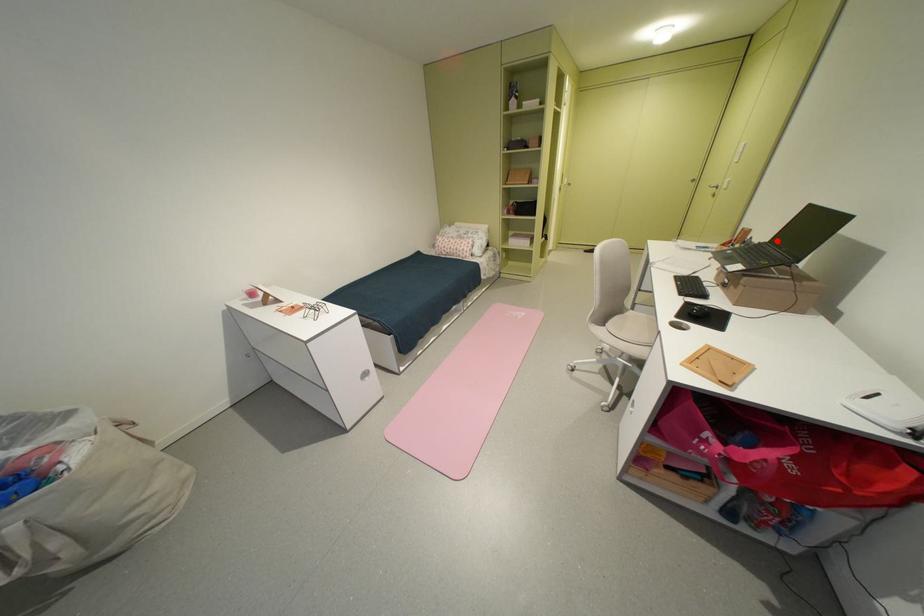
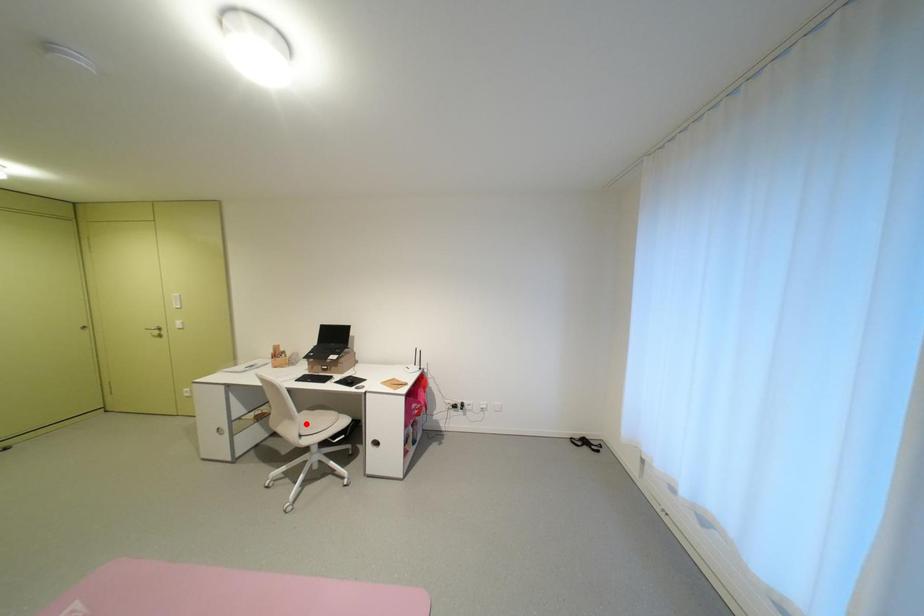
Looking at this image, I am providing you with two images of the same scene from different viewpoints. A red point is marked on the first image and another point is marked on the second image. Is the marked point in image1 the same physical position as the marked point in image2?

No